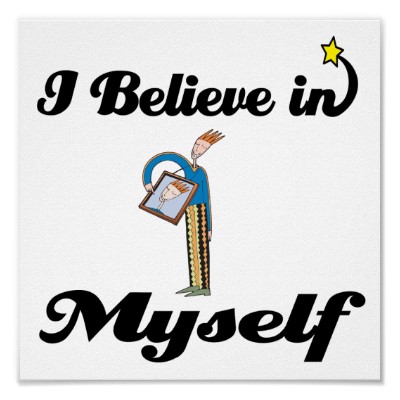
Identify the location of picture frame. (162, 177).